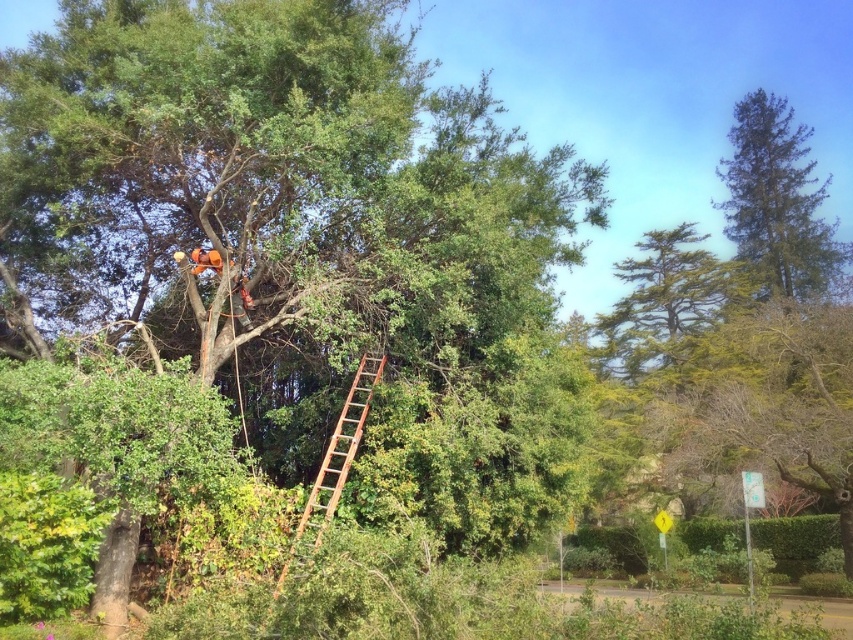
You are a tree maintenance worker planning to prune branches from the green leafy tree at upper center and the green textured tree at upper right. Based on their widths, which tree requires more space to work on?

The green leafy tree at upper center requires more space to work on because its width is larger than the green textured tree at upper right.

You are a tree maintenance worker who needs to climb the tree for pruning. Given that the green leafy tree at upper center and the rusty wood ladder at center are in your view, which object would you use to ascend the tree?

The rusty wood ladder at center is the object used to ascend the tree since it is a ladder placed at the base of the tree, while the green leafy tree at upper center is the tree itself that needs pruning.

Based on the photo, you are a professional arborist assessing the distance between two trees in a forest. You need to determine if a new irrigation system can be installed between the green leafy tree at upper center and the green textured tree at upper right. The system requires a minimum of 100 feet of space between trees for proper installation. Based on the scene, can the irrigation system be installed between these two trees?

The distance between the green leafy tree at upper center and the green textured tree at upper right is 111.54 feet, which exceeds the required 100 feet. Therefore, the irrigation system can be installed between these two trees.